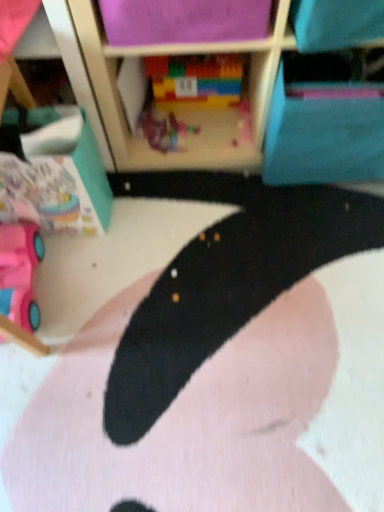
Question: Is plastic toy at center, the second toy viewed from the right, not near pink plastic toy car at lower left, the third toy from the top?

Choices:
 (A) no
 (B) yes

Answer: (A)

Question: Considering the relative positions of plastic toy at center, the 2th toy in the top-to-bottom sequence, and pink plastic toy car at lower left, positioned as the 1th toy in bottom-to-top order, in the image provided, is plastic toy at center, the 2th toy in the top-to-bottom sequence, to the left of pink plastic toy car at lower left, positioned as the 1th toy in bottom-to-top order, from the viewer's perspective?

Choices:
 (A) yes
 (B) no

Answer: (B)

Question: Can you confirm if plastic toy at center, acting as the second toy starting from the bottom, is bigger than pink plastic toy car at lower left, the third toy from the top?

Choices:
 (A) no
 (B) yes

Answer: (A)

Question: Does plastic toy at center, acting as the second toy starting from the bottom, have a lesser height compared to pink plastic toy car at lower left, the third toy from the top?

Choices:
 (A) no
 (B) yes

Answer: (B)

Question: Can you confirm if plastic toy at center, the second toy viewed from the right, is wider than pink plastic toy car at lower left, marked as the first toy in a left-to-right arrangement?

Choices:
 (A) yes
 (B) no

Answer: (B)

Question: From the image's perspective, is black matte rug at center positioned above or below plastic toy at center, which is counted as the second toy, starting from the left?

Choices:
 (A) above
 (B) below

Answer: (B)

Question: Considering the positions of black matte rug at center and plastic toy at center, which is counted as the second toy, starting from the left, in the image, is black matte rug at center wider or thinner than plastic toy at center, which is counted as the second toy, starting from the left,?

Choices:
 (A) wide
 (B) thin

Answer: (A)

Question: In terms of height, does black matte rug at center look taller or shorter compared to plastic toy at center, the second toy viewed from the right?

Choices:
 (A) short
 (B) tall

Answer: (B)

Question: Based on their sizes in the image, would you say black matte rug at center is bigger or smaller than plastic toy at center, the 2th toy in the top-to-bottom sequence?

Choices:
 (A) big
 (B) small

Answer: (A)

Question: Is point (322, 158) positioned closer to the camera than point (195, 125)?

Choices:
 (A) closer
 (B) farther

Answer: (A)

Question: In terms of width, does blue fabric cabinet at upper right look wider or thinner when compared to plastic toy at center, acting as the second toy starting from the bottom?

Choices:
 (A) thin
 (B) wide

Answer: (B)

Question: Would you say blue fabric cabinet at upper right is inside or outside plastic toy at center, the second toy viewed from the right?

Choices:
 (A) inside
 (B) outside

Answer: (B)

Question: In terms of size, does blue fabric cabinet at upper right appear bigger or smaller than plastic toy at center, the second toy viewed from the right?

Choices:
 (A) small
 (B) big

Answer: (B)

Question: Based on their sizes in the image, would you say multicolored plastic blocks at center, which is the 3th toy from bottom to top, is bigger or smaller than pink plastic toy car at lower left, the third toy from the top?

Choices:
 (A) small
 (B) big

Answer: (A)

Question: Relative to pink plastic toy car at lower left, positioned as the 1th toy in bottom-to-top order, is multicolored plastic blocks at center, which is the 3th toy from bottom to top, in front or behind?

Choices:
 (A) behind
 (B) front

Answer: (A)